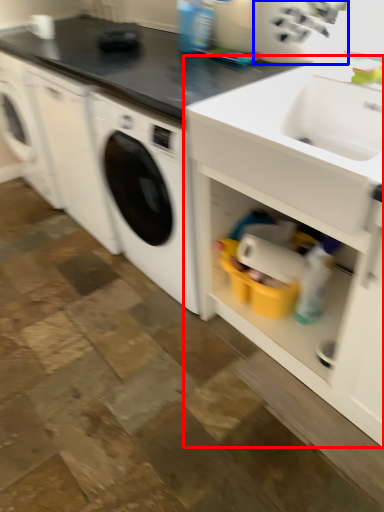
Question: Which object is closer to the camera taking this photo, cabinetry (highlighted by a red box) or appliance (highlighted by a blue box)?

Choices:
 (A) cabinetry
 (B) appliance

Answer: (A)